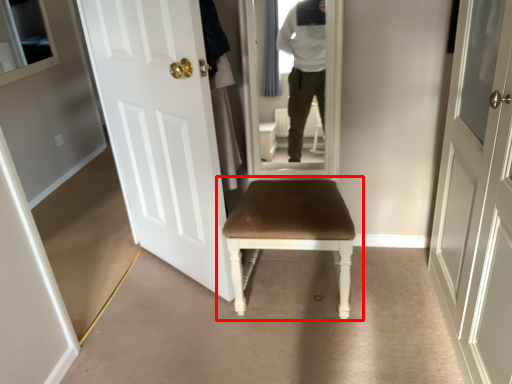
Question: From the image, what is the correct spatial relationship of chair (annotated by the red box) in relation to door?

Choices:
 (A) right
 (B) left

Answer: (A)